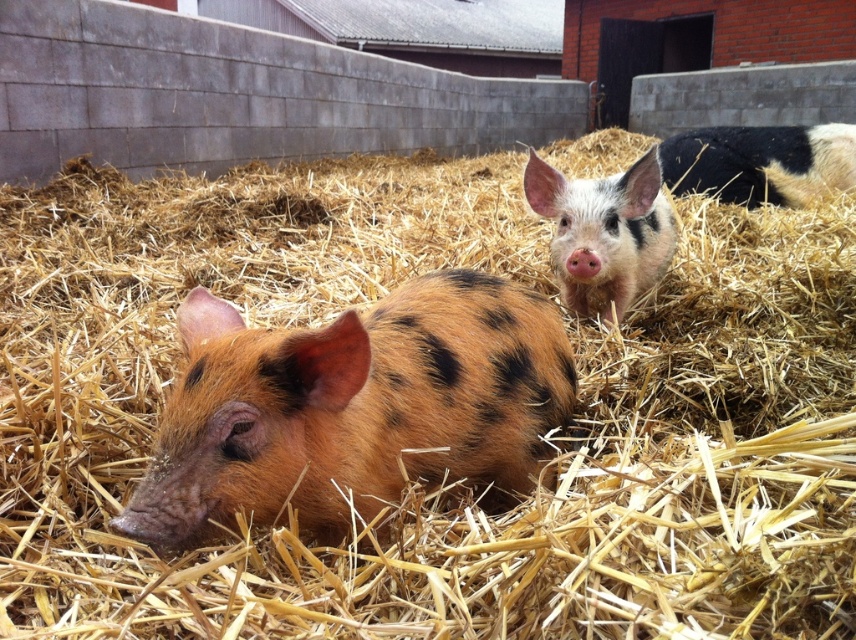
You are a farmer checking the piglets in the barn. You see the spotted fur piglet at center and the black and white spotted pig at upper right. Which piglet is located above the other?

The black and white spotted pig at upper right is above the spotted fur piglet at center because the spotted fur piglet at center is positioned under it.

You are standing in the barn and see a point marked at coordinates (x=352, y=406). What object is located at this point?

The point at coordinates (x=352, y=406) corresponds to the spotted fur pig at center.